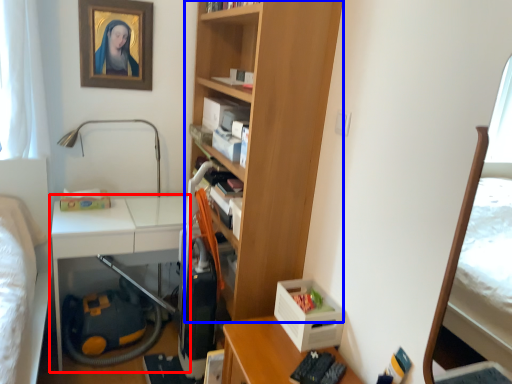
Question: Which object appears farthest to the camera in this image, table (highlighted by a red box) or bookcase (highlighted by a blue box)?

Choices:
 (A) table
 (B) bookcase

Answer: (A)